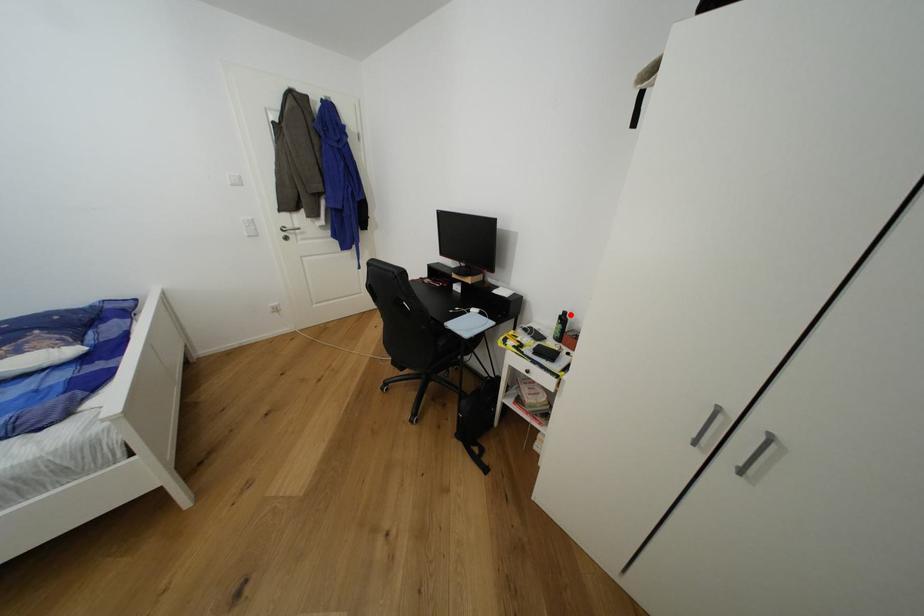
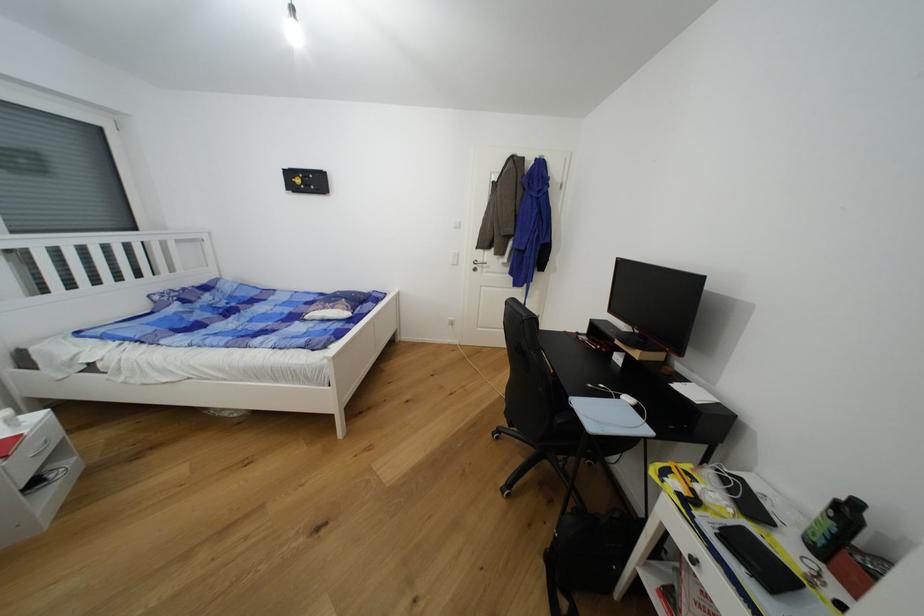
Where in the second image is the point corresponding to the highlighted location from the first image?

(862, 506)